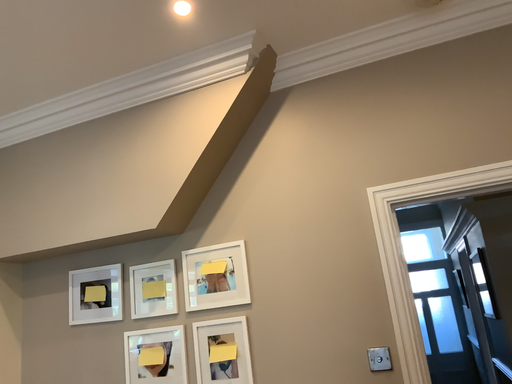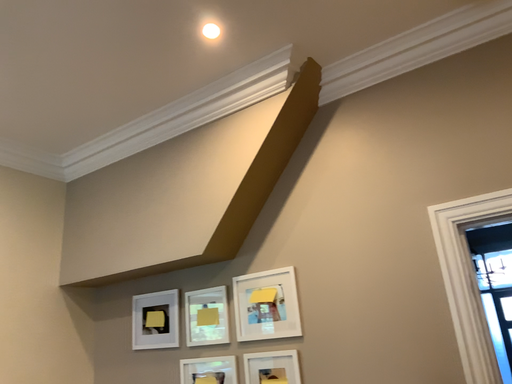
Question: Which way did the camera rotate in the video?

Choices:
 (A) rotated right
 (B) rotated left

Answer: (B)